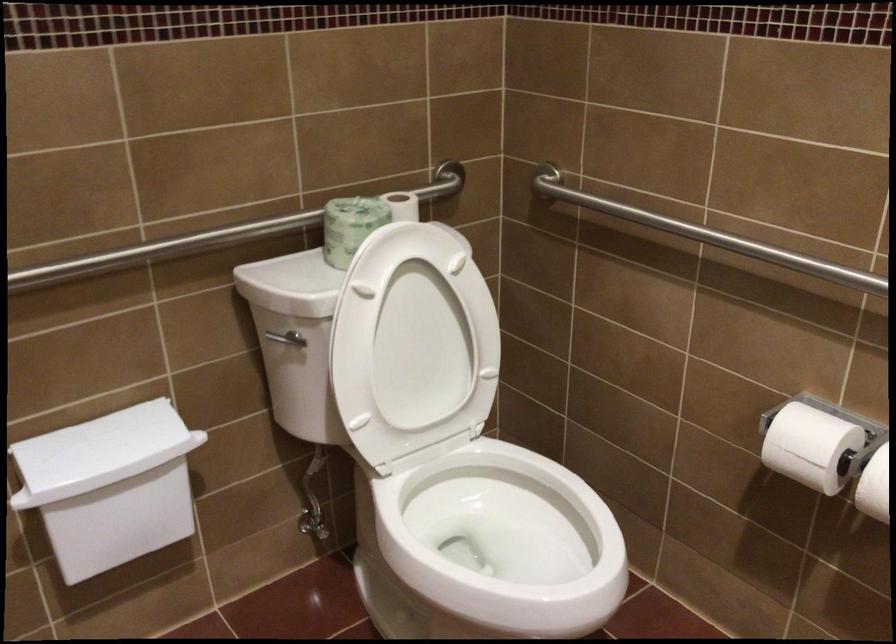
This screenshot has height=644, width=896. Describe the element at coordinates (281, 343) in the screenshot. I see `the toilet flush handle` at that location.